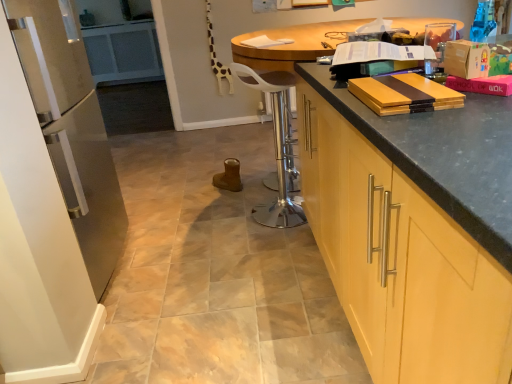
Identify the location of vacant space in front of yellow wood cutting board at upper right, which is the first book from bottom to top. (432, 123).